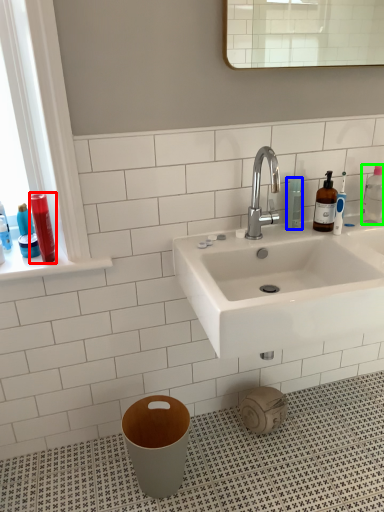
Question: Which object is the farthest from toiletry (highlighted by a red box)? Choose among these: mouthwash (highlighted by a blue box) or cleaning product (highlighted by a green box).

Choices:
 (A) mouthwash
 (B) cleaning product

Answer: (B)